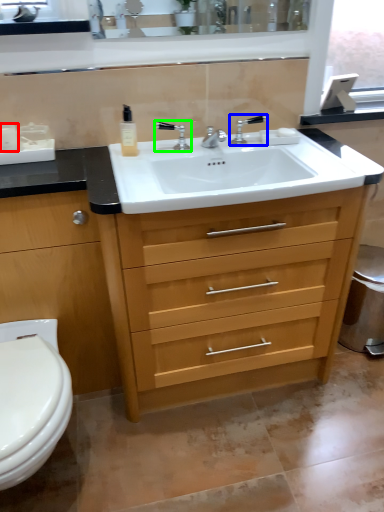
Question: Considering the real-world distances, which object is closest to toiletry (highlighted by a red box)? tap (highlighted by a blue box) or tap (highlighted by a green box).

Choices:
 (A) tap
 (B) tap

Answer: (B)